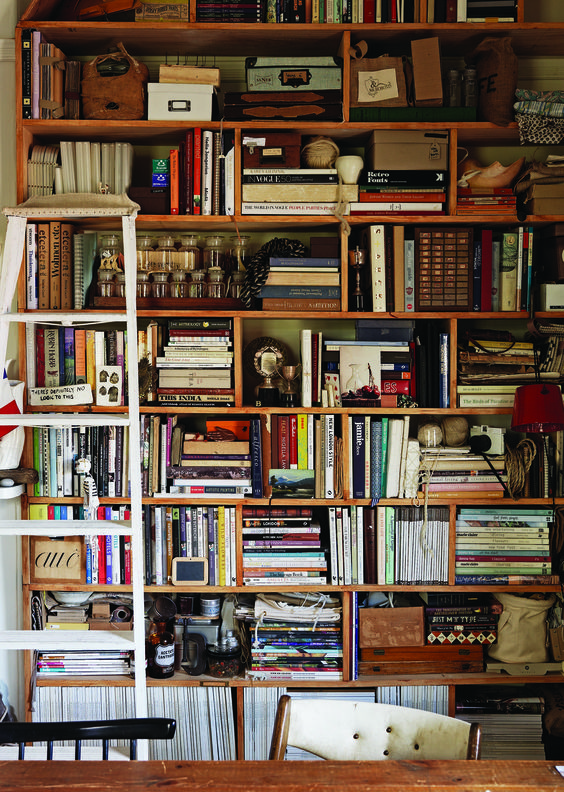
At what (x,y) coordinates should I click in order to perform the action: click on shelves. Please return your answer as a coordinate pair (x, y). The image size is (564, 792). Looking at the image, I should click on pos(504,676), pos(385,587), pos(392,500), pos(389,406), pos(337,310), pos(403,215), pos(365,124), pos(305,23).